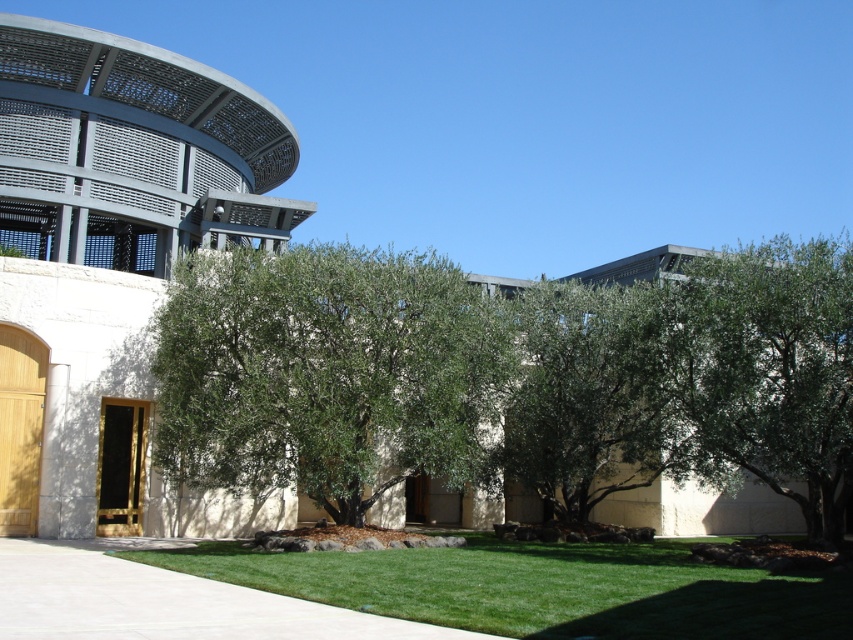
You are a landscape architect planning to install a new sprinkler system. The sprinkler has a maximum range of 7 meters. If you position the sprinkler at the green lawn at center, will it be able to water the green leafy tree at center?

The green lawn at center and green leafy tree at center are 7.28 meters apart from each other. Since the sprinkler has a maximum range of 7 meters, it cannot reach the green leafy tree at center from the green lawn at center.

You are a landscape architect designing a pathway between the green lawn at center and the green leafy tree at center. Which area requires a wider pathway to accommodate its size?

The green lawn at center requires a wider pathway because its width surpasses that of the green leafy tree at center.